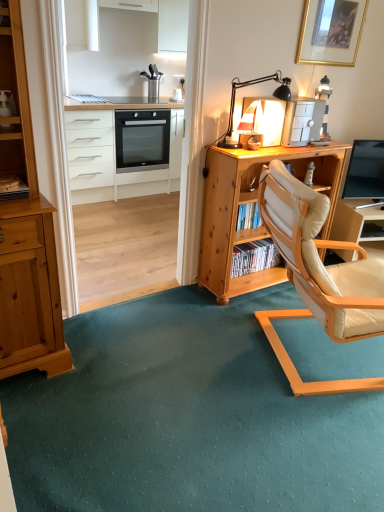
Question: From the image's perspective, does gold-framed picture at upper right appear lower than light wood desk at center?

Choices:
 (A) yes
 (B) no

Answer: (B)

Question: Is gold-framed picture at upper right bigger than light wood desk at center?

Choices:
 (A) no
 (B) yes

Answer: (A)

Question: Can you confirm if gold-framed picture at upper right is shorter than light wood desk at center?

Choices:
 (A) no
 (B) yes

Answer: (B)

Question: Is gold-framed picture at upper right wider than light wood desk at center?

Choices:
 (A) yes
 (B) no

Answer: (B)

Question: From a real-world perspective, is gold-framed picture at upper right under light wood desk at center?

Choices:
 (A) yes
 (B) no

Answer: (B)

Question: Does gold-framed picture at upper right appear on the right side of light wood desk at center?

Choices:
 (A) no
 (B) yes

Answer: (B)

Question: Does light wood desk at center turn towards matte white lamp at upper center, which is the 1th appliance in left-to-right order?

Choices:
 (A) yes
 (B) no

Answer: (B)

Question: Is light wood desk at center beside matte white lamp at upper center, which is the 1th appliance in left-to-right order?

Choices:
 (A) no
 (B) yes

Answer: (A)

Question: Is light wood desk at center far away from matte white lamp at upper center, placed as the 2th appliance when sorted from right to left?

Choices:
 (A) yes
 (B) no

Answer: (B)

Question: Is light wood desk at center turned away from matte white lamp at upper center, which is the 1th appliance in left-to-right order?

Choices:
 (A) yes
 (B) no

Answer: (B)

Question: Can you confirm if light wood desk at center is bigger than matte white lamp at upper center, which is the 1th appliance in left-to-right order?

Choices:
 (A) yes
 (B) no

Answer: (A)

Question: From a real-world perspective, is light wood desk at center under matte white lamp at upper center, which is the 1th appliance in left-to-right order?

Choices:
 (A) yes
 (B) no

Answer: (A)

Question: Considering the relative sizes of matte white lamp at upper center, which is the 1th appliance in left-to-right order, and beige leather chair at center-right in the image provided, is matte white lamp at upper center, which is the 1th appliance in left-to-right order, smaller than beige leather chair at center-right?

Choices:
 (A) yes
 (B) no

Answer: (A)